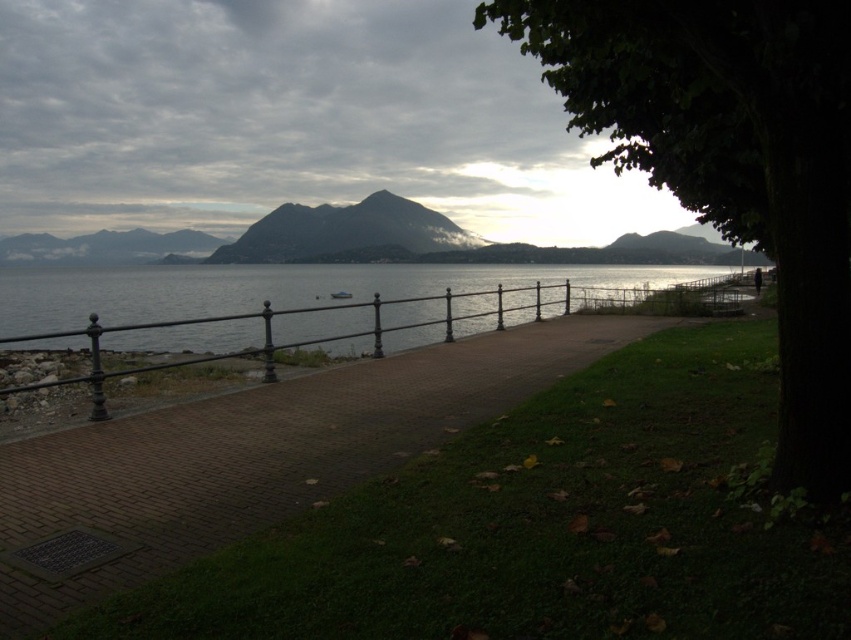
From the picture: You are standing on the lakeside pathway and want to see both the clear water at center and the gray rocky mountain at center. Which one will appear taller to you?

The gray rocky mountain at center appears taller than the clear water at center because the clear water at center has a lesser height compared to the gray rocky mountain at center.

You are a hiker who wants to take a photo of the green leafy tree at right and the brick paved path at center. Since you have a camera with a fixed focal length, you need to know which object is bigger to adjust your settings. Can you tell me which one is larger?

The green leafy tree at right is larger in size than the brick paved path at center, so you should adjust your camera settings for the larger object.